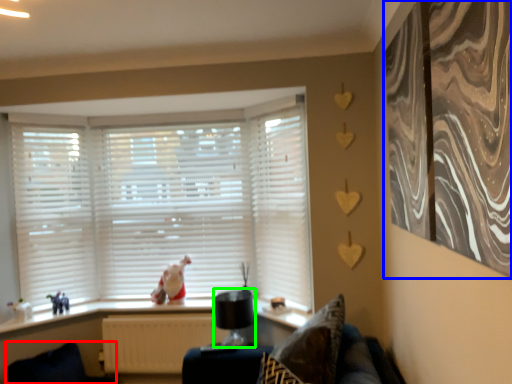
Question: Which object is positioned closest to swivel chair (highlighted by a red box)? Select from curtain (highlighted by a blue box) and lamp (highlighted by a green box).

Choices:
 (A) curtain
 (B) lamp

Answer: (B)